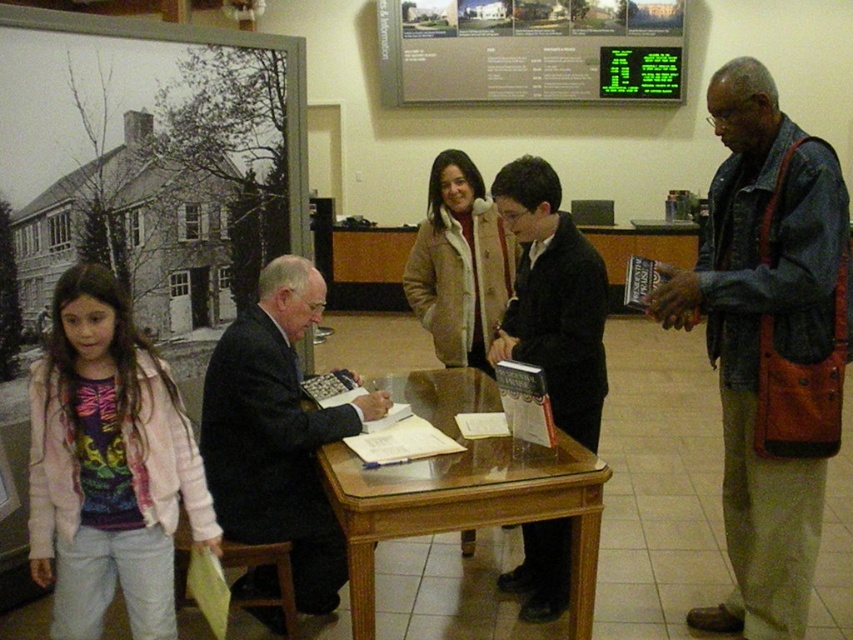
You are organizing a community event and need to arrange seating. If you have a bench that can only accommodate items up to the width of the black suit jacket at center, will the light pink fleece jacket at left fit on it?

The light pink fleece jacket at left is wider than the black suit jacket at center, so it will not fit on the bench designed for the black suit jacket at center.

You are organizing an event and need to ensure there is enough space between the black suit at center and the green digital display at upper center for a 1.2 meter wide banner. Based on the scene description, can you confirm if the space between them is sufficient?

The black suit at center has a smaller size compared to green digital display at upper center, but the exact distance between them isn not specified in the provided information. Therefore, it is unclear if the space is sufficient for a 1.2 meter wide banner.

You are an event organizer who needs to set up a new sign at the bottom of the green digital display at upper center. Where should you place it so it aligns with the black suit at center?

The black suit at center is located below the green digital display at upper center, so placing the sign directly below the green digital display at upper center will align it with the black suit at center.